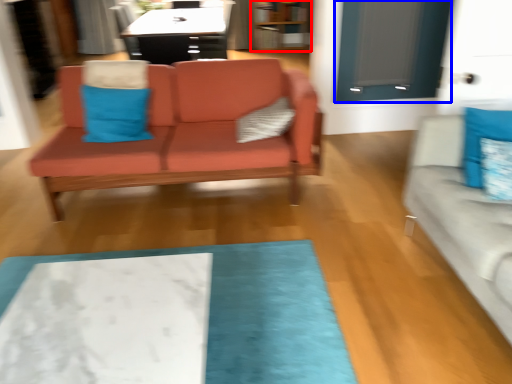
Question: Which of the following is the farthest to the observer, bookshelf (highlighted by a red box) or glass door (highlighted by a blue box)?

Choices:
 (A) bookshelf
 (B) glass door

Answer: (A)